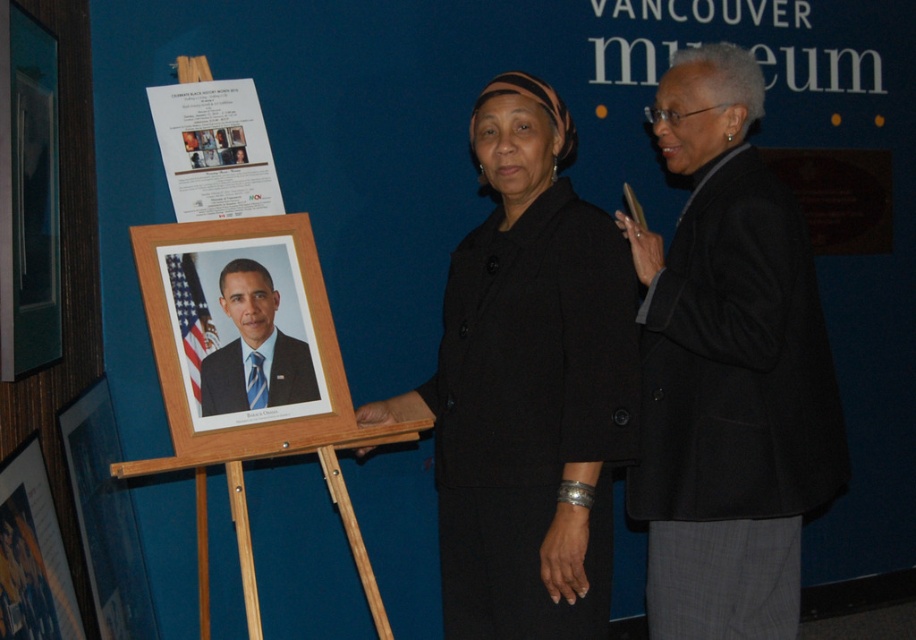
Can you confirm if wooden easel at center is smaller than white paper poster at upper left?

No, wooden easel at center is not smaller than white paper poster at upper left.

Who is more distant from viewer, [216,429] or [256,141]?

Point [256,141]

Measure the distance between point (164, 244) and camera.

A distance of 2.23 meters exists between point (164, 244) and camera.

The image size is (916, 640). In order to click on wooden easel at center in this screenshot , I will do `click(248, 374)`.

The image size is (916, 640). Describe the element at coordinates (728, 371) in the screenshot. I see `black wool jacket at right` at that location.

Between black wool jacket at right and wooden easel at center, which one appears on the left side from the viewer's perspective?

Positioned to the left is wooden easel at center.

From the picture: Who is more forward, (776, 292) or (192, 372)?

Point (776, 292)

Where is `black wool jacket at right`? black wool jacket at right is located at coordinates (728, 371).

Does black wool coat at center lie in front of black wool jacket at right?

Yes, black wool coat at center is in front of black wool jacket at right.

Is point (688, 413) positioned behind point (799, 282)?

Yes, point (688, 413) is behind point (799, 282).

Where is `black wool coat at center`? Image resolution: width=916 pixels, height=640 pixels. black wool coat at center is located at coordinates (728, 369).

This screenshot has width=916, height=640. In order to click on black wool coat at center in this screenshot , I will do `click(728, 369)`.